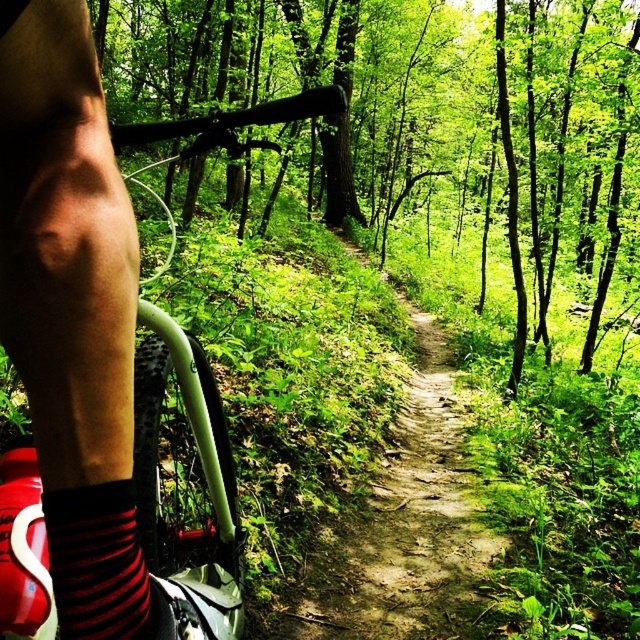
Question: Considering the real-world distances, which object is closest to the dirt path at center?

Choices:
 (A) green matte mountain bike at left
 (B) red striped sock at lower left
 (C) black sock at left

Answer: (A)

Question: Can you confirm if dirt path at center is positioned below green matte mountain bike at left?

Choices:
 (A) no
 (B) yes

Answer: (B)

Question: Can you confirm if dirt path at center is smaller than green matte mountain bike at left?

Choices:
 (A) yes
 (B) no

Answer: (B)

Question: Estimate the real-world distances between objects in this image. Which object is closer to the green matte mountain bike at left?

Choices:
 (A) red striped sock at lower left
 (B) dirt path at center
 (C) black sock at left

Answer: (C)

Question: Which object is the closest to the dirt path at center?

Choices:
 (A) black sock at left
 (B) red striped sock at lower left
 (C) green matte mountain bike at left

Answer: (C)

Question: Can you confirm if black sock at left is positioned to the right of dirt path at center?

Choices:
 (A) yes
 (B) no

Answer: (B)